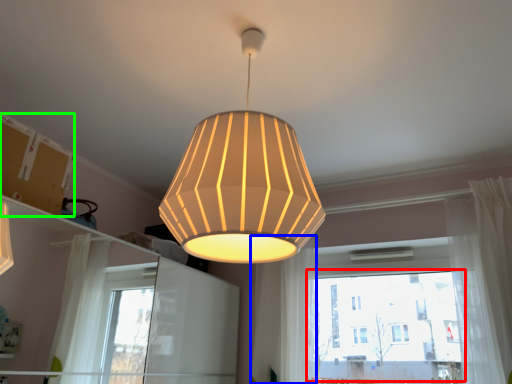
Question: Which is farther away from bay window (highlighted by a red box)? curtain (highlighted by a blue box) or cardboard box (highlighted by a green box)?

Choices:
 (A) curtain
 (B) cardboard box

Answer: (B)